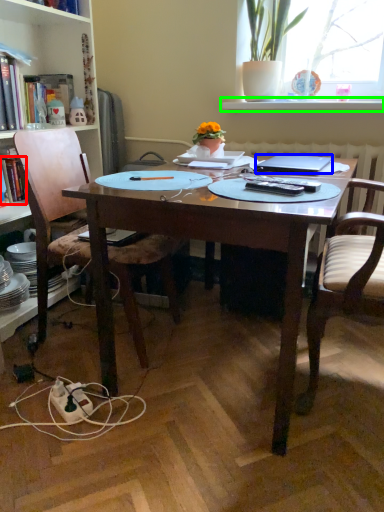
Question: Estimate the real-world distances between objects in this image. Which object is farther from book (highlighted by a red box), laptop (highlighted by a blue box) or window sill (highlighted by a green box)?

Choices:
 (A) laptop
 (B) window sill

Answer: (B)